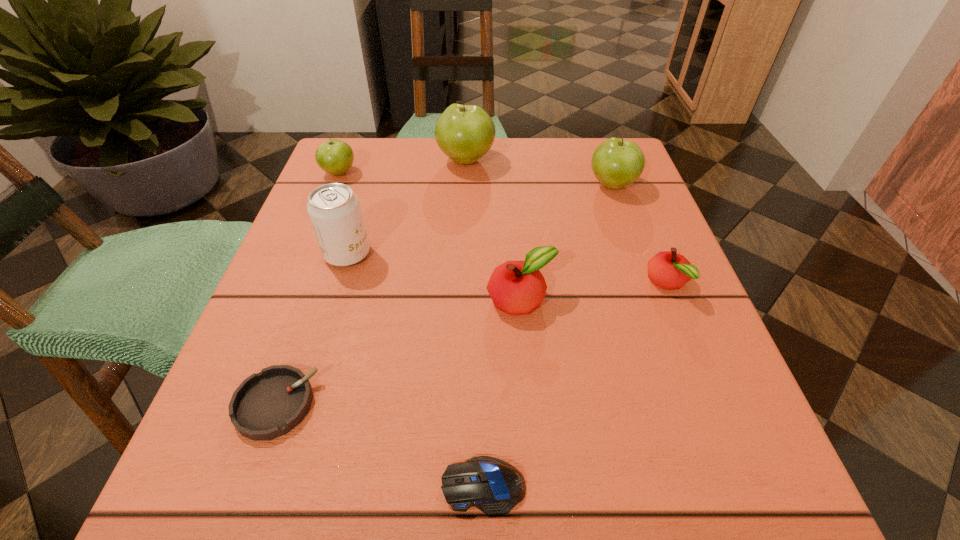
The image size is (960, 540). Find the location of `the second green apple from right to left`. the second green apple from right to left is located at coordinates (465, 133).

Where is `the biggest green apple`? the biggest green apple is located at coordinates (465, 133).

Where is `soda can`? soda can is located at coordinates 334,210.

Locate an element on the screen. This screenshot has width=960, height=540. the second smallest green apple is located at coordinates (616, 163).

In order to click on the fourth shortest apple in this screenshot , I will do `click(616, 163)`.

I want to click on the smallest green apple, so click(x=335, y=157).

Where is `the leftmost apple`? The image size is (960, 540). the leftmost apple is located at coordinates (335, 157).

Locate an element on the screen. This screenshot has height=540, width=960. the left red apple is located at coordinates (516, 287).

Where is `the third shortest object`? The width and height of the screenshot is (960, 540). the third shortest object is located at coordinates (669, 270).

The image size is (960, 540). What are the coordinates of `the shortest apple` in the screenshot? It's located at (669, 270).